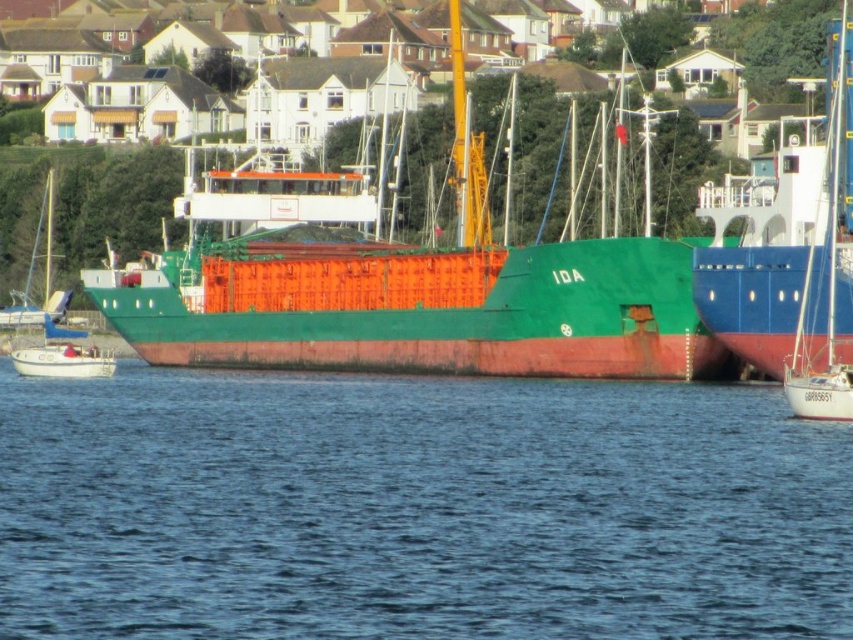
You are navigating a small boat and want to pass between the blue water at center and the green matte cargo ship at center. Which direction should you go to avoid hitting the ship?

The blue water at center is positioned on the right side of green matte cargo ship at center, so you should steer your boat to the right of the green matte cargo ship at center to navigate safely between them.

You are standing on the deck of the cargo ship IDA and want to locate the blue water at center. According to the coordinates provided, where should you look relative to your position?

The blue water at center is located at coordinates point (x=416, y=508), which means it is positioned slightly to the right and below your current viewpoint on the deck of the cargo ship IDA.

You are a sailor who needs to navigate your boat to the dock near the residential area. You see the blue water at center and the white sailboat at right. Which direction should you steer your boat to reach the dock?

The blue water at center is positioned under the white sailboat at right, so steering towards the blue water at center would lead you closer to the dock near the residential area.